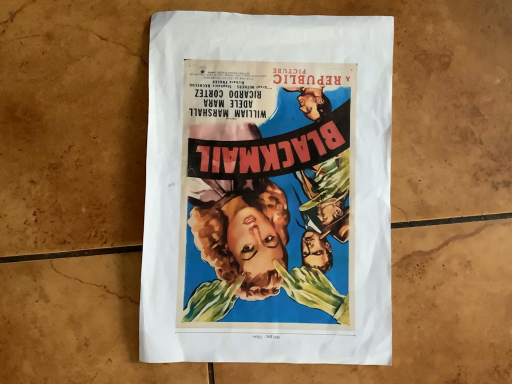
Identify the location of vibrant paper poster at center. This screenshot has width=512, height=384. (268, 190).

Describe the element at coordinates (268, 190) in the screenshot. The height and width of the screenshot is (384, 512). I see `vibrant paper poster at center` at that location.

Find the location of a particular element. Image resolution: width=512 pixels, height=384 pixels. vibrant paper poster at center is located at coordinates (268, 190).